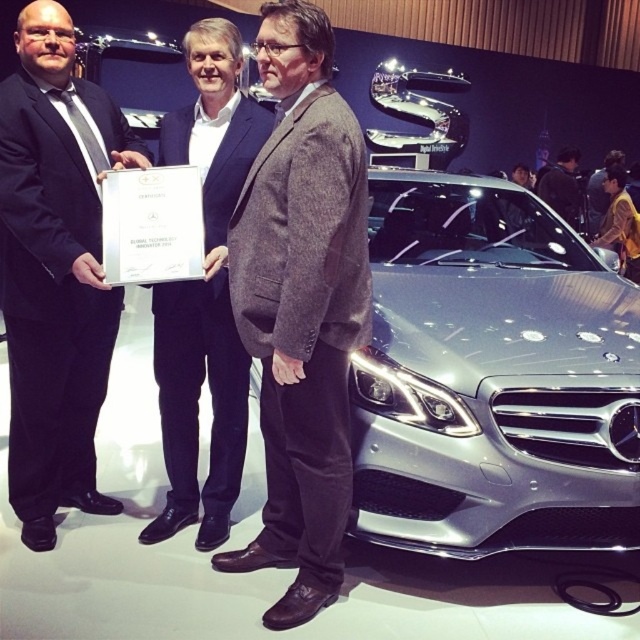
Question: Does sleek metallic car at center have a greater width compared to dark gray suit at center?

Choices:
 (A) yes
 (B) no

Answer: (A)

Question: Which of these objects is positioned closest to the sleek metallic car at center?

Choices:
 (A) gray woolen blazer at center
 (B) yellow fabric shirt at right
 (C) dark gray suit at center

Answer: (A)

Question: Which is nearer to the yellow fabric shirt at right?

Choices:
 (A) black suit at left
 (B) sleek metallic car at center
 (C) gray woolen blazer at center

Answer: (B)

Question: Which point is farther to the camera?

Choices:
 (A) black suit at left
 (B) dark gray suit at center

Answer: (B)

Question: From the image, what is the correct spatial relationship of black suit at left in relation to dark gray suit at center?

Choices:
 (A) above
 (B) below

Answer: (B)

Question: Is black suit at left thinner than dark gray suit at center?

Choices:
 (A) yes
 (B) no

Answer: (A)